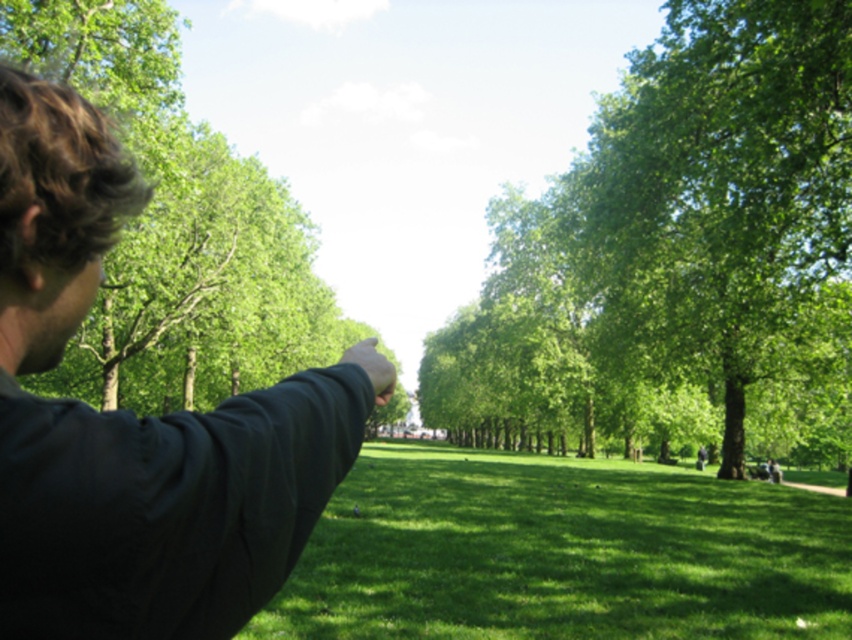
Can you confirm if green leafy tree at center is taller than green grassy field at center?

Yes.

Who is shorter, green leafy tree at center or green grassy field at center?

With less height is green grassy field at center.

This screenshot has height=640, width=852. Describe the element at coordinates (678, 250) in the screenshot. I see `green leafy tree at center` at that location.

I want to click on green leafy tree at center, so click(x=678, y=250).

What do you see at coordinates (678, 250) in the screenshot? The image size is (852, 640). I see `green leafy tree at center` at bounding box center [678, 250].

Which is below, green leafy tree at center or dark green fabric arm at left?

Positioned lower is dark green fabric arm at left.

Who is more distant from viewer, (x=830, y=45) or (x=197, y=554)?

Point (x=830, y=45)

You are a GUI agent. You are given a task and a screenshot of the screen. Output one action in this format:
    pyautogui.click(x=<x>, y=<y>)
    Task: Click on the green leafy tree at center
    The image size is (852, 640).
    Given the screenshot: What is the action you would take?
    pyautogui.click(x=678, y=250)

Which is more to the left, dark green fabric arm at left or green grassy field at center?

dark green fabric arm at left

Can you confirm if dark green fabric arm at left is positioned above green grassy field at center?

Indeed, dark green fabric arm at left is positioned over green grassy field at center.

What do you see at coordinates (137, 422) in the screenshot? Image resolution: width=852 pixels, height=640 pixels. I see `dark green fabric arm at left` at bounding box center [137, 422].

Locate an element on the screen. Image resolution: width=852 pixels, height=640 pixels. dark green fabric arm at left is located at coordinates coord(137,422).